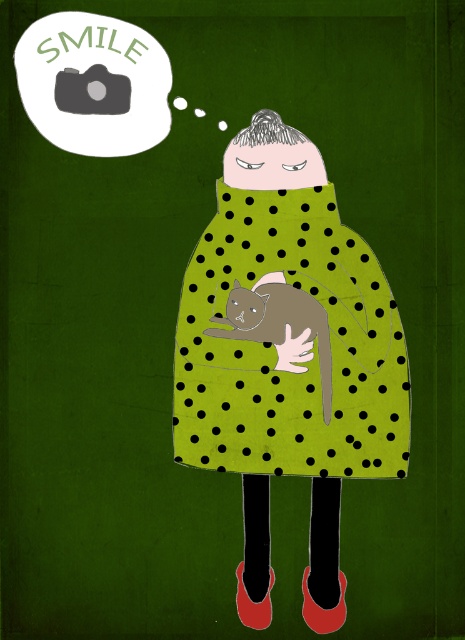
Question: Which of the following is the closest to the observer?

Choices:
 (A) (285, 346)
 (B) (88, 115)
 (C) (251, 374)

Answer: (B)

Question: Does green dotted blanket at center have a larger size compared to green matte hand at center?

Choices:
 (A) no
 (B) yes

Answer: (B)

Question: Is green dotted blanket at center below gray soft cat at center?

Choices:
 (A) yes
 (B) no

Answer: (B)

Question: Which of the following is the closest to the observer?

Choices:
 (A) (194, 369)
 (B) (301, 355)

Answer: (B)

Question: Among these objects, which one is nearest to the camera?

Choices:
 (A) green dotted blanket at center
 (B) green matte hand at center

Answer: (A)

Question: Is green dotted blanket at center below gray soft cat at center?

Choices:
 (A) no
 (B) yes

Answer: (A)